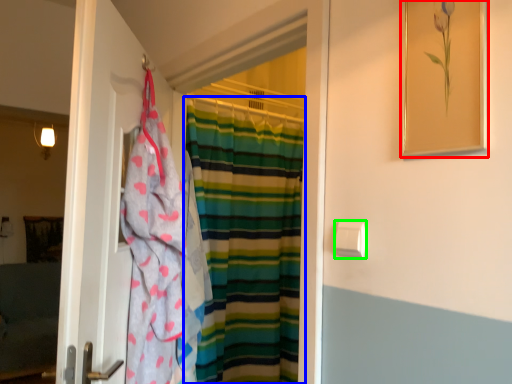
Question: Considering the real-world distances, which object is closest to picture frame (highlighted by a red box)? curtain (highlighted by a blue box) or towel bar (highlighted by a green box).

Choices:
 (A) curtain
 (B) towel bar

Answer: (B)